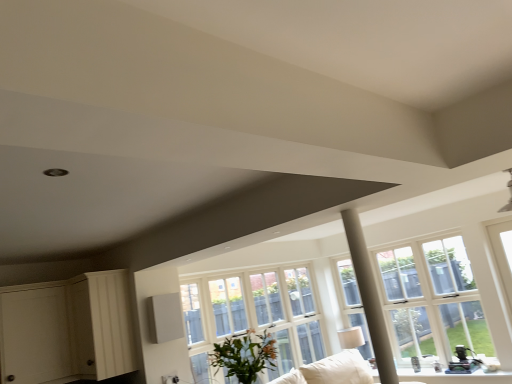
Question: From the image's perspective, is clear glass window at center above or below green leafy plant at center?

Choices:
 (A) above
 (B) below

Answer: (B)

Question: Is clear glass window at center inside or outside of green leafy plant at center?

Choices:
 (A) outside
 (B) inside

Answer: (A)

Question: Estimate the real-world distances between objects in this image. Which object is farther from the green leafy plant at center?

Choices:
 (A) white fabric couch at lower center
 (B) clear glass window at center
 (C) white wood dresser at lower left

Answer: (B)

Question: Which of these objects is positioned farthest from the clear glass window at center?

Choices:
 (A) white fabric couch at lower center
 (B) green leafy plant at center
 (C) white wood dresser at lower left

Answer: (C)